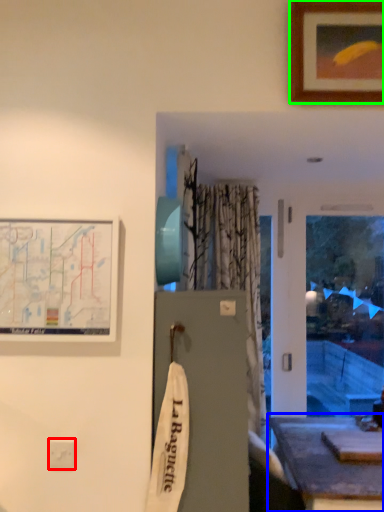
Question: Estimate the real-world distances between objects in this image. Which object is closer to electric outlet (highlighted by a red box), table (highlighted by a blue box) or picture frame (highlighted by a green box)?

Choices:
 (A) table
 (B) picture frame

Answer: (A)